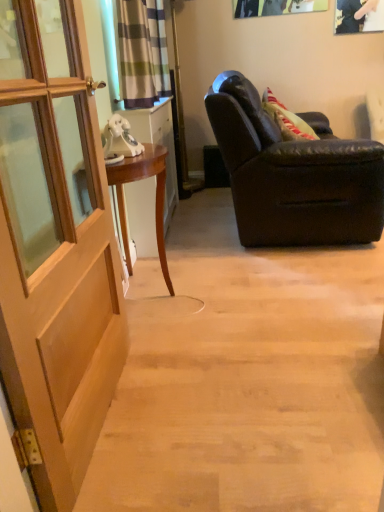
Question: From the image's perspective, does matte black leather armchair at right appear lower than striped fabric curtain at upper center?

Choices:
 (A) yes
 (B) no

Answer: (A)

Question: Does matte black leather armchair at right have a lesser width compared to striped fabric curtain at upper center?

Choices:
 (A) no
 (B) yes

Answer: (A)

Question: Is striped fabric curtain at upper center at the back of matte black leather armchair at right?

Choices:
 (A) no
 (B) yes

Answer: (A)

Question: Could you tell me if matte black leather armchair at right is facing striped fabric curtain at upper center?

Choices:
 (A) yes
 (B) no

Answer: (B)

Question: Does matte black leather armchair at right have a lesser height compared to striped fabric curtain at upper center?

Choices:
 (A) no
 (B) yes

Answer: (A)

Question: Is the position of matte black leather armchair at right more distant than that of striped fabric curtain at upper center?

Choices:
 (A) yes
 (B) no

Answer: (A)

Question: Is metallic silver picture frame at upper right surrounded by mahogany wood desk at left?

Choices:
 (A) yes
 (B) no

Answer: (B)

Question: Could you tell me if mahogany wood desk at left is turned towards metallic silver picture frame at upper right?

Choices:
 (A) yes
 (B) no

Answer: (B)

Question: Is mahogany wood desk at left next to metallic silver picture frame at upper right and touching it?

Choices:
 (A) yes
 (B) no

Answer: (B)

Question: Can you confirm if mahogany wood desk at left is shorter than metallic silver picture frame at upper right?

Choices:
 (A) yes
 (B) no

Answer: (B)

Question: Is the depth of mahogany wood desk at left greater than that of metallic silver picture frame at upper right?

Choices:
 (A) yes
 (B) no

Answer: (B)

Question: Can you confirm if mahogany wood desk at left is thinner than metallic silver picture frame at upper right?

Choices:
 (A) no
 (B) yes

Answer: (A)

Question: From a real-world perspective, is striped fabric curtain at upper center under mahogany wood desk at left?

Choices:
 (A) no
 (B) yes

Answer: (A)